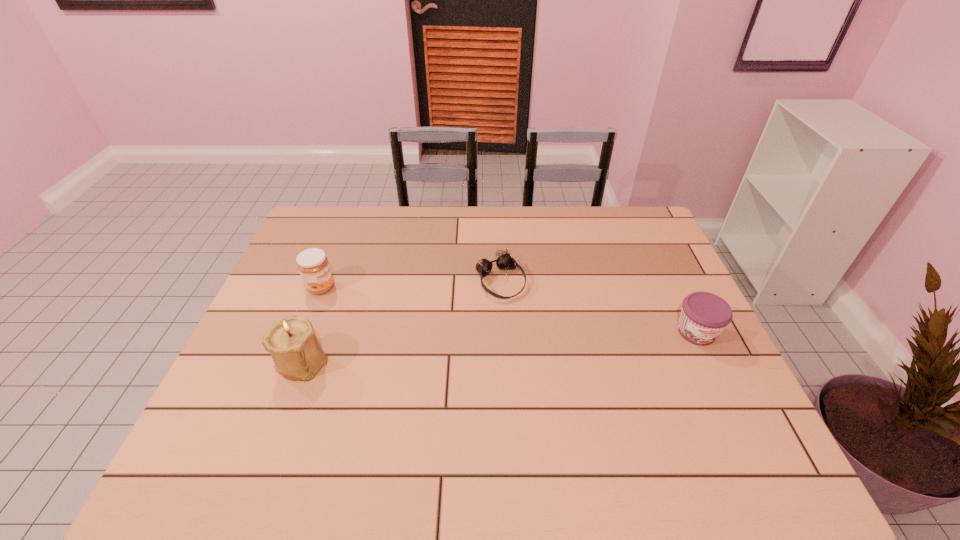
In order to click on vacant space at the right edge of the desktop in this screenshot , I will do `click(659, 268)`.

Where is `free space at the far left corner of the desktop`? This screenshot has height=540, width=960. free space at the far left corner of the desktop is located at coordinates (309, 224).

The width and height of the screenshot is (960, 540). In the image, there is a desktop. Identify the location of vacant space at the far right corner. (623, 210).

This screenshot has width=960, height=540. Identify the location of empty space between the tallest object and the nearer jam. click(499, 346).

Locate an element on the screen. free space between the goggles and the candle_holder is located at coordinates (401, 320).

What are the coordinates of `empty space between the nearer jam and the tallest object` in the screenshot? It's located at (499, 346).

Identify the location of free space between the candle_holder and the goggles. (401, 320).

Where is `free space between the nearer jam and the second tallest object`? The width and height of the screenshot is (960, 540). free space between the nearer jam and the second tallest object is located at coordinates (509, 310).

Locate an element on the screen. vacant area that lies between the tallest object and the second shortest object is located at coordinates click(x=499, y=346).

This screenshot has height=540, width=960. Identify the location of empty space between the nearer jam and the goggles. (598, 306).